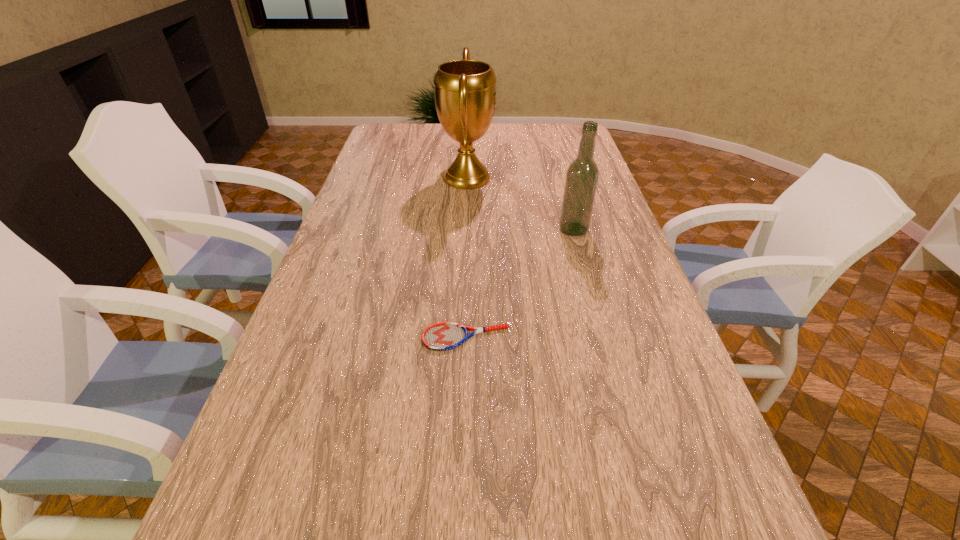
This screenshot has width=960, height=540. Find the location of `free space that satisfies the following two spatial constraints: 1. on the surface of the tennis racket with symbols; 2. on the right side of the trophy cup`. free space that satisfies the following two spatial constraints: 1. on the surface of the tennis racket with symbols; 2. on the right side of the trophy cup is located at coordinates (460, 338).

You are a GUI agent. You are given a task and a screenshot of the screen. Output one action in this format:
    pyautogui.click(x=<x>, y=<y>)
    Task: Click on the vacant point that satisfies the following two spatial constraints: 1. on the surface of the trophy cup with symbols; 2. on the left side of the second farthest object
    
    Given the screenshot: What is the action you would take?
    pyautogui.click(x=465, y=230)

Image resolution: width=960 pixels, height=540 pixels. I want to click on vacant space that satisfies the following two spatial constraints: 1. on the surface of the nearest object with symbols; 2. on the right side of the trophy cup, so click(x=460, y=338).

Identify the location of free spot that satisfies the following two spatial constraints: 1. on the back side of the nearest object; 2. on the surface of the farthest object with symbols. (470, 178).

Locate an element on the screen. The image size is (960, 540). free point that satisfies the following two spatial constraints: 1. on the surface of the second farthest object with symbols; 2. on the right side of the tallest object is located at coordinates (465, 230).

Where is `vacant area in the image that satisfies the following two spatial constraints: 1. on the surface of the tallest object with symbols; 2. on the back side of the second tallest object`? Image resolution: width=960 pixels, height=540 pixels. vacant area in the image that satisfies the following two spatial constraints: 1. on the surface of the tallest object with symbols; 2. on the back side of the second tallest object is located at coordinates (465, 230).

The height and width of the screenshot is (540, 960). Identify the location of free space that satisfies the following two spatial constraints: 1. on the surface of the liquor with symbols; 2. on the right side of the trophy cup. (465, 230).

Identify the location of vacant area that satisfies the following two spatial constraints: 1. on the surface of the liquor with symbols; 2. on the right side of the tallest object. (465, 230).

You are a GUI agent. You are given a task and a screenshot of the screen. Output one action in this format:
    pyautogui.click(x=<x>, y=<y>)
    Task: Click on the vacant space that satisfies the following two spatial constraints: 1. on the back side of the nearest object; 2. on the left side of the liquor
    This screenshot has height=540, width=960.
    Given the screenshot: What is the action you would take?
    pyautogui.click(x=469, y=230)